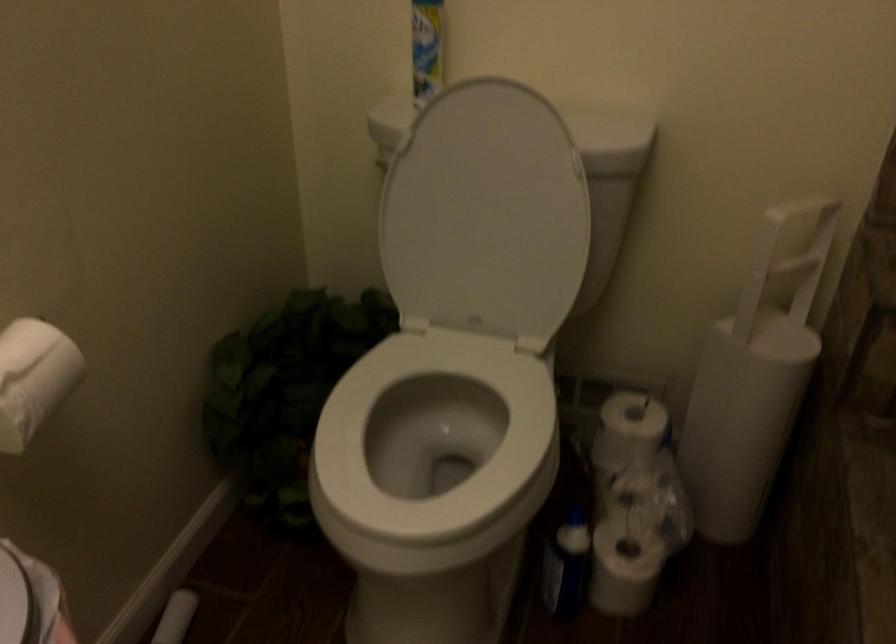
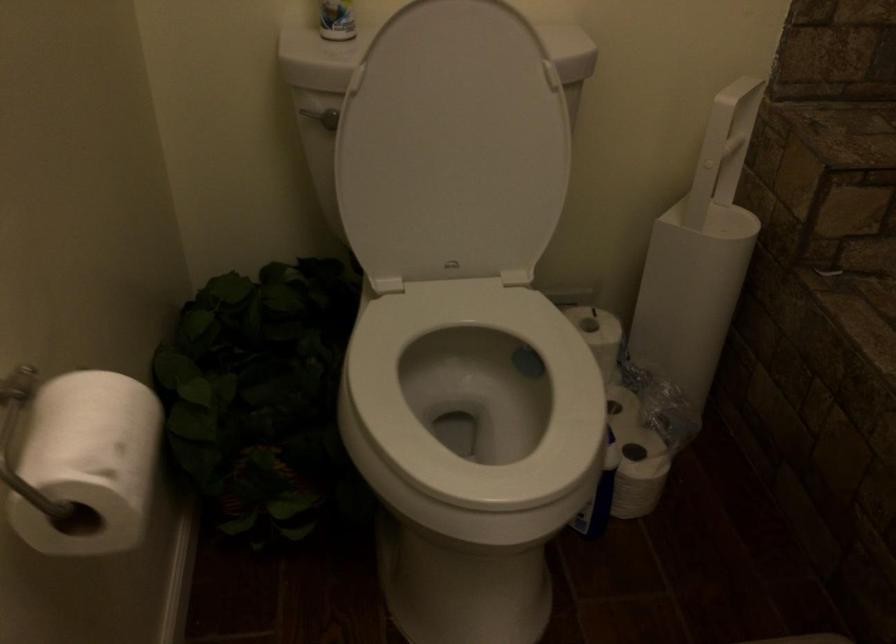
Question: The camera is either moving clockwise (left) or counter-clockwise (right) around the object. The first image is from the beginning of the video and the second image is from the end. Is the camera moving left or right when shooting the video?

Choices:
 (A) Left
 (B) Right

Answer: (A)